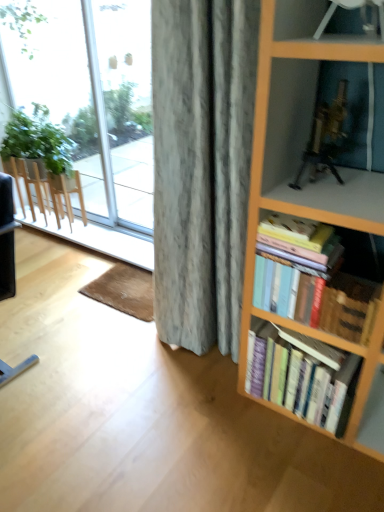
Locate an element on the screen. The image size is (384, 512). vacant space behind black leather chair at lower left is located at coordinates (36, 305).